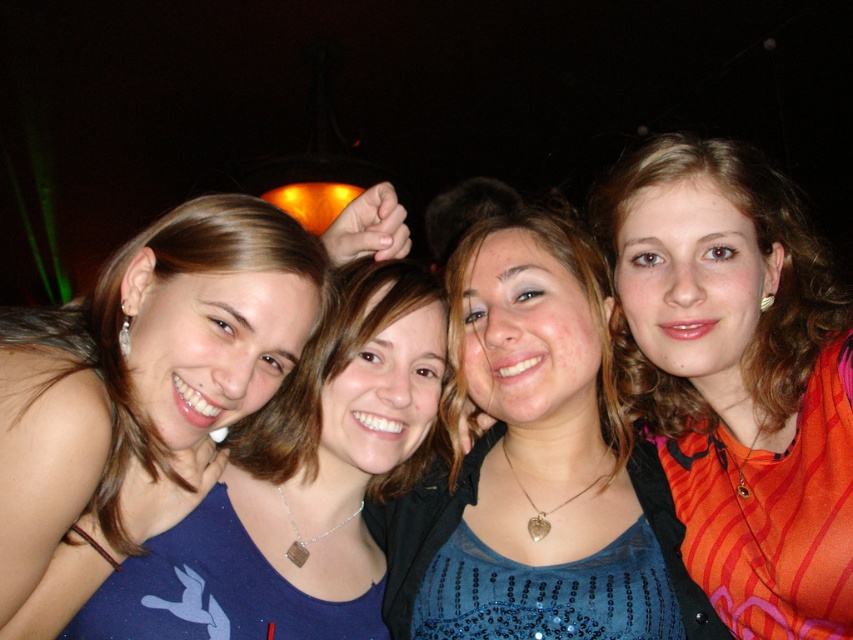
Between orange striped shirt at right and blue sequined top at center, which one is positioned higher?

orange striped shirt at right is above.

Can you confirm if orange striped shirt at right is positioned above blue sequined top at center?

Yes, orange striped shirt at right is above blue sequined top at center.

Does point (688, 416) come behind point (665, 572)?

Yes, point (688, 416) is behind point (665, 572).

I want to click on orange striped shirt at right, so click(x=740, y=378).